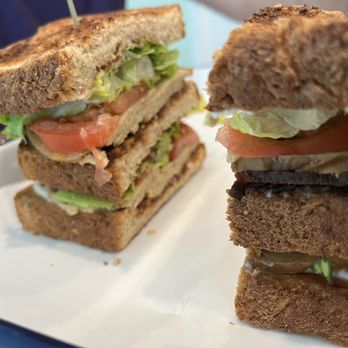
Where is `plate`? plate is located at coordinates (206, 340).